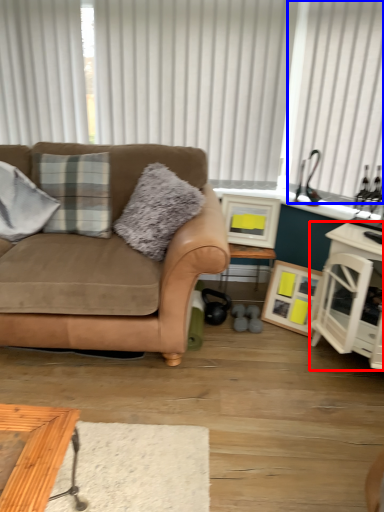
Question: Which point is further to the camera, cabinetry (highlighted by a red box) or curtain (highlighted by a blue box)?

Choices:
 (A) cabinetry
 (B) curtain

Answer: (B)